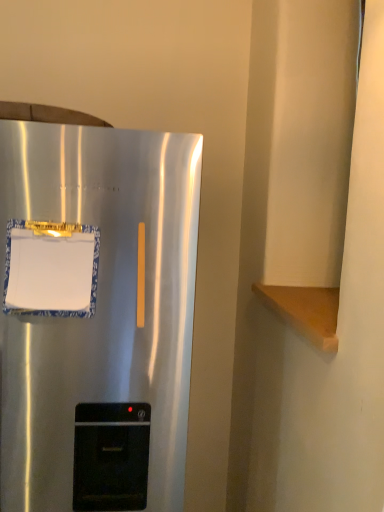
Identify the location of white paper at left. The height and width of the screenshot is (512, 384). (51, 269).

The image size is (384, 512). What do you see at coordinates (51, 269) in the screenshot?
I see `white paper at left` at bounding box center [51, 269].

What do you see at coordinates (95, 316) in the screenshot?
I see `satin silver refrigerator at left` at bounding box center [95, 316].

Locate an element on the screen. The image size is (384, 512). satin silver refrigerator at left is located at coordinates (95, 316).

Where is `white paper at left`? Image resolution: width=384 pixels, height=512 pixels. white paper at left is located at coordinates (51, 269).

Considering the relative positions of white paper at left and satin silver refrigerator at left in the image provided, is white paper at left to the left or to the right of satin silver refrigerator at left?

Based on their positions, white paper at left is located to the right of satin silver refrigerator at left.

Which object is closer to the camera, white paper at left or satin silver refrigerator at left?

satin silver refrigerator at left is more forward.

Is point (35, 262) closer to viewer compared to point (68, 205)?

Yes, it is in front of point (68, 205).

From the image's perspective, between white paper at left and satin silver refrigerator at left, who is located below?

From the image's view, satin silver refrigerator at left is below.

Consider the image. From a real-world perspective, does white paper at left stand above satin silver refrigerator at left?

Yes, from a real-world perspective, white paper at left is on top of satin silver refrigerator at left.

Does white paper at left have a greater width compared to satin silver refrigerator at left?

Incorrect, the width of white paper at left does not surpass that of satin silver refrigerator at left.

Considering the sizes of objects white paper at left and satin silver refrigerator at left in the image provided, who is taller, white paper at left or satin silver refrigerator at left?

Standing taller between the two is satin silver refrigerator at left.

Consider the image. Considering the sizes of white paper at left and satin silver refrigerator at left in the image, is white paper at left bigger or smaller than satin silver refrigerator at left?

white paper at left is smaller than satin silver refrigerator at left.

Could satin silver refrigerator at left be considered to be inside white paper at left?

No, satin silver refrigerator at left is not inside white paper at left.

Are white paper at left and satin silver refrigerator at left beside each other?

No, white paper at left is not touching satin silver refrigerator at left.

Is white paper at left positioned with its back to satin silver refrigerator at left?

Yes.

Locate an element on the screen. This screenshot has width=384, height=512. refrigerator in front of the white paper at left is located at coordinates (95, 316).

Considering the relative positions of satin silver refrigerator at left and white paper at left in the image provided, is satin silver refrigerator at left to the left of white paper at left from the viewer's perspective?

Correct, you'll find satin silver refrigerator at left to the left of white paper at left.

Is the position of satin silver refrigerator at left more distant than that of white paper at left?

No, it is in front of white paper at left.

From the picture: Which point is more forward, (117, 443) or (8, 313)?

The point (8, 313) is more forward.

From the image's perspective, who appears lower, satin silver refrigerator at left or white paper at left?

From the image's view, satin silver refrigerator at left is below.

From a real-world perspective, is satin silver refrigerator at left positioned above or below white paper at left?

satin silver refrigerator at left is situated lower than white paper at left in the real world.

Does satin silver refrigerator at left have a greater width compared to white paper at left?

Yes, satin silver refrigerator at left is wider than white paper at left.

Can you confirm if satin silver refrigerator at left is taller than white paper at left?

Yes, satin silver refrigerator at left is taller than white paper at left.

Who is smaller, satin silver refrigerator at left or white paper at left?

With smaller size is white paper at left.

Is satin silver refrigerator at left surrounding white paper at left?

Yes, satin silver refrigerator at left contains white paper at left.

Are satin silver refrigerator at left and white paper at left located far from each other?

No, satin silver refrigerator at left is in close proximity to white paper at left.

Is satin silver refrigerator at left oriented away from white paper at left?

No, white paper at left is not at the back of satin silver refrigerator at left.

How different are the orientations of satin silver refrigerator at left and white paper at left in degrees?

The facing directions of satin silver refrigerator at left and white paper at left are 0.0736 degrees apart.

In order to click on paper behind the satin silver refrigerator at left in this screenshot , I will do `click(51, 269)`.

The height and width of the screenshot is (512, 384). I want to click on refrigerator that is on the left side of white paper at left, so click(x=95, y=316).

Identify the location of refrigerator below the white paper at left (from a real-world perspective). (95, 316).